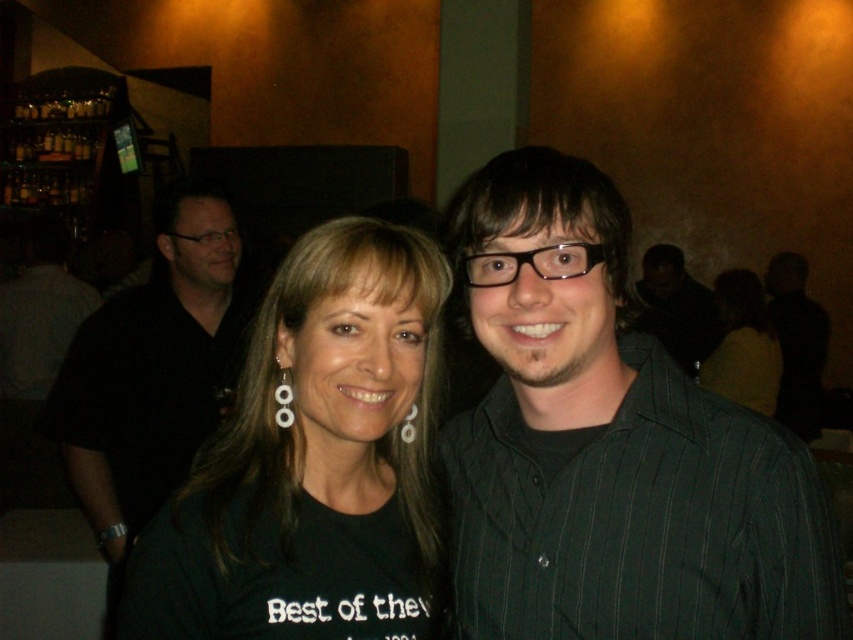
Question: Does matte black shirt at center appear over white pearl earring at center?

Choices:
 (A) yes
 (B) no

Answer: (A)

Question: Estimate the real-world distances between objects in this image. Which object is closer to the black fabric shirt at center?

Choices:
 (A) black pinstriped shirt at right
 (B) green striped shirt at center

Answer: (B)

Question: Which point appears closest to the camera in this image?

Choices:
 (A) (770, 573)
 (B) (750, 280)
 (C) (787, 298)
 (D) (283, 403)

Answer: (A)

Question: Which point is closer to the camera taking this photo?

Choices:
 (A) (738, 307)
 (B) (785, 316)
 (C) (718, 330)
 (D) (90, 314)

Answer: (D)

Question: Can you confirm if green striped shirt at center is positioned below matte black shirt at center?

Choices:
 (A) no
 (B) yes

Answer: (B)

Question: Is matte black shirt at center thinner than black matte shirt at center?

Choices:
 (A) no
 (B) yes

Answer: (B)